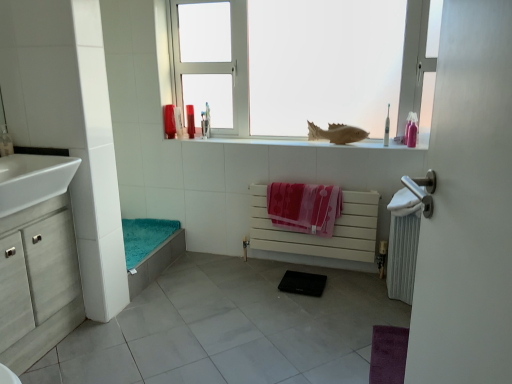
Locate an element on the screen. The image size is (512, 384). free location to the right of matte plastic soap dispenser at upper left, the sixth toiletry viewed from the back is located at coordinates (36, 153).